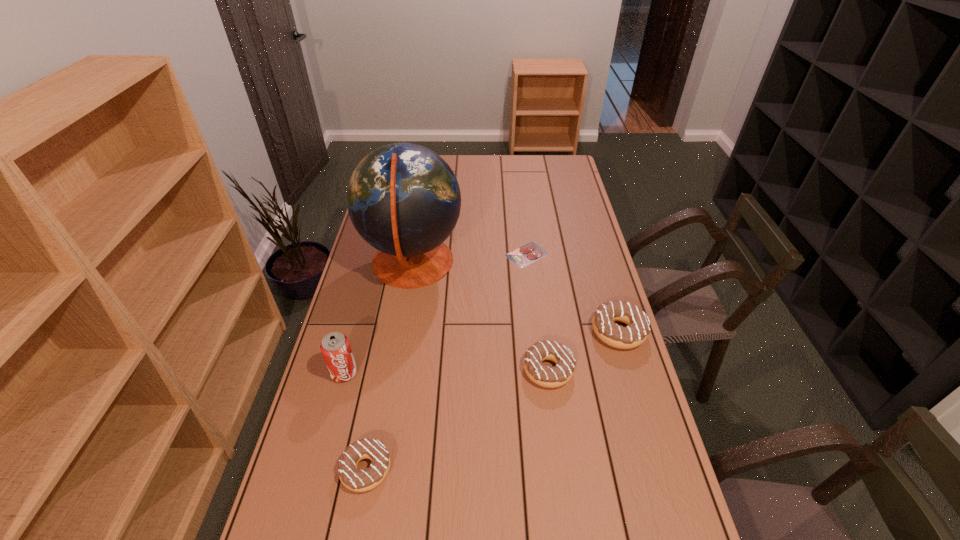
Identify the location of free spot that satisfies the following two spatial constraints: 1. on the back side of the third shortest object; 2. on the left side of the rightmost doughnut. The width and height of the screenshot is (960, 540). (543, 332).

Image resolution: width=960 pixels, height=540 pixels. Find the location of `free space that satisfies the following two spatial constraints: 1. on the front side of the soda can; 2. on the left side of the shortest doughnut`. free space that satisfies the following two spatial constraints: 1. on the front side of the soda can; 2. on the left side of the shortest doughnut is located at coordinates (319, 469).